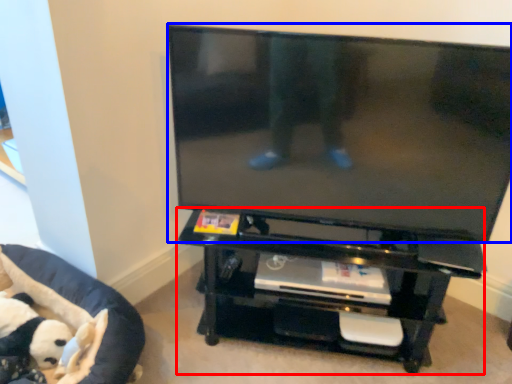
Question: Which of the following is the closest to the observer, entertainment center (highlighted by a red box) or television (highlighted by a blue box)?

Choices:
 (A) entertainment center
 (B) television

Answer: (B)